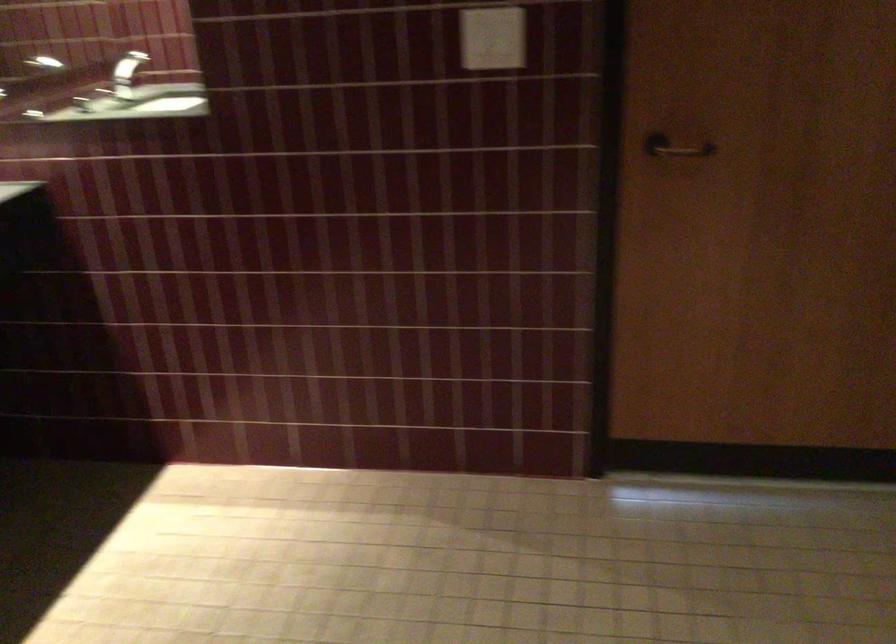
This screenshot has width=896, height=644. I want to click on black door handle, so click(857, 321).